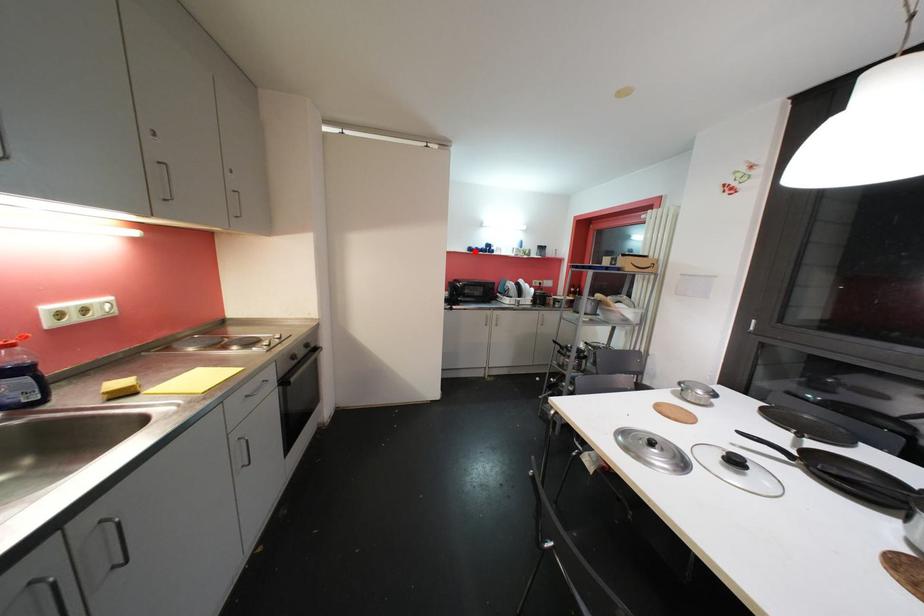
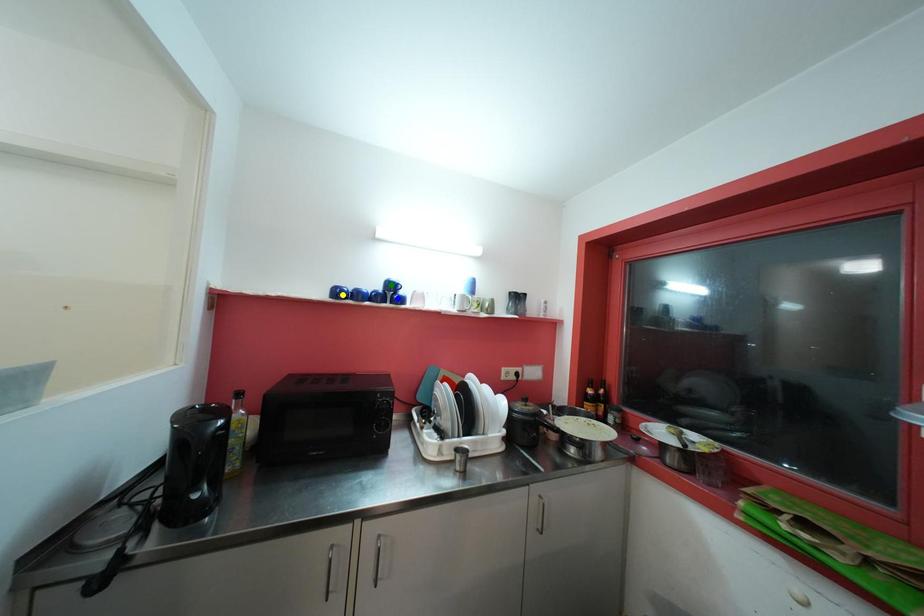
Question: I am providing you with two images of the same scene from different viewpoints. A red point is marked on the first image. You are given multiple points on the second image. Which point in image 2 is actually the same real-world point as the red point in image 1?

Choices:
 (A) yellow point
 (B) green point
 (C) blue point

Answer: (A)